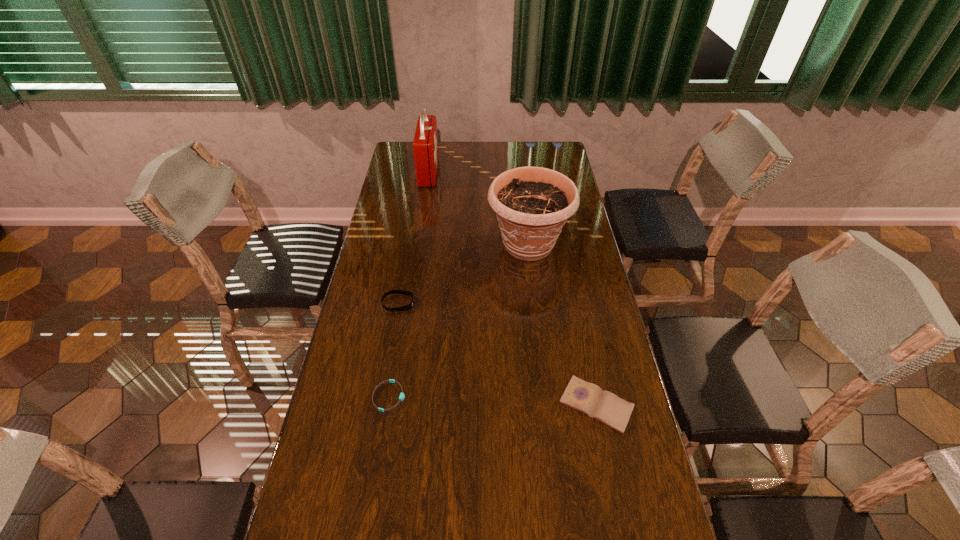
Locate an element on the screen. The image size is (960, 540). the first-aid kit is located at coordinates (425, 144).

Where is `flowerpot`? The height and width of the screenshot is (540, 960). flowerpot is located at coordinates (532, 204).

Locate an element on the screen. This screenshot has width=960, height=540. the second farthest object is located at coordinates (532, 204).

The height and width of the screenshot is (540, 960). What are the coordinates of `the third farthest object` in the screenshot? It's located at (404, 308).

Where is `the taller wristband`? The height and width of the screenshot is (540, 960). the taller wristband is located at coordinates (404, 308).

Where is `the fourth tallest object`? the fourth tallest object is located at coordinates (586, 397).

What are the coordinates of `the nearer wristband` in the screenshot? It's located at (401, 397).

Image resolution: width=960 pixels, height=540 pixels. I want to click on the shortest object, so click(x=401, y=397).

The height and width of the screenshot is (540, 960). Identify the location of vacant space located 0.280m on the front face of the farthest object. (499, 172).

Identify the location of free location located on the back of the second tallest object. Image resolution: width=960 pixels, height=540 pixels. (524, 205).